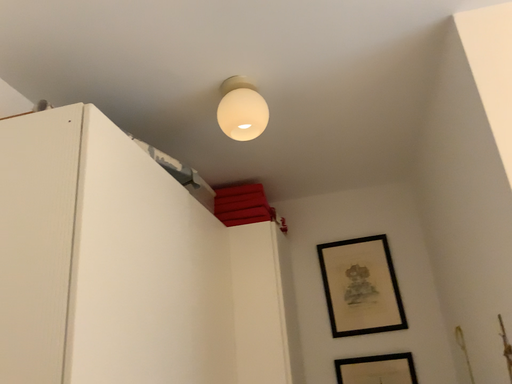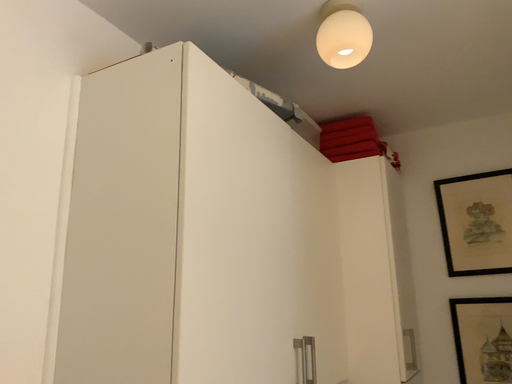
Question: How did the camera likely rotate when shooting the video?

Choices:
 (A) rotated downward
 (B) rotated upward

Answer: (A)